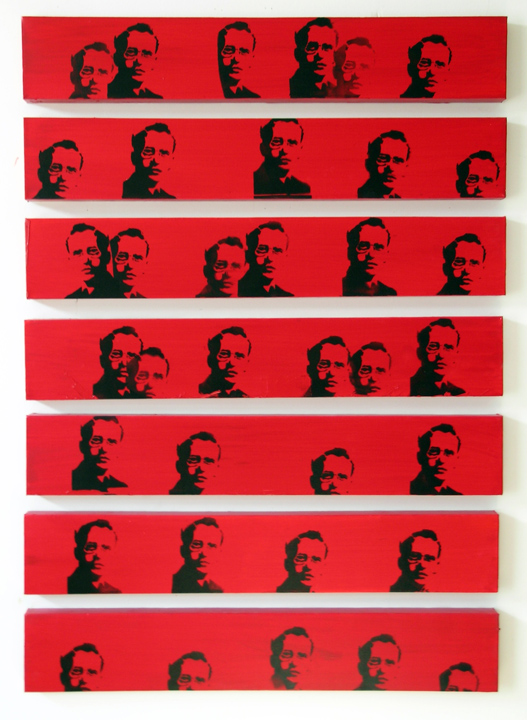
What are the coordinates of `slight shadow on the right side of each slat` in the screenshot? It's located at (517, 65), (514, 156), (514, 250), (511, 361), (512, 451), (512, 556), (504, 647).